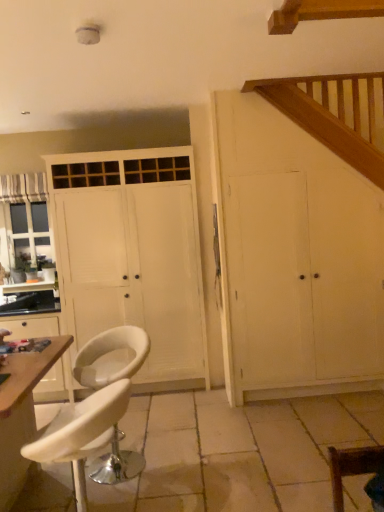
Question: Is matte white cabinet at left outside of striped fabric curtain at left?

Choices:
 (A) yes
 (B) no

Answer: (A)

Question: Is matte white cabinet at left positioned in front of striped fabric curtain at left?

Choices:
 (A) yes
 (B) no

Answer: (A)

Question: From the image's perspective, is matte white cabinet at left beneath striped fabric curtain at left?

Choices:
 (A) no
 (B) yes

Answer: (B)

Question: From the image's perspective, is matte white cabinet at left above striped fabric curtain at left?

Choices:
 (A) yes
 (B) no

Answer: (B)

Question: Is matte white cabinet at left not close to striped fabric curtain at left?

Choices:
 (A) no
 (B) yes

Answer: (B)

Question: Is matte white cabinet at left at the right side of striped fabric curtain at left?

Choices:
 (A) no
 (B) yes

Answer: (B)

Question: From the image's perspective, is white matte cabinet at center, the second cupboard in the right-to-left sequence, located beneath white wood cupboard at right, the 1th cupboard viewed from the right?

Choices:
 (A) yes
 (B) no

Answer: (B)

Question: Is white matte cabinet at center, the second cupboard in the right-to-left sequence, taller than white wood cupboard at right, which ranks as the second cupboard in left-to-right order?

Choices:
 (A) yes
 (B) no

Answer: (A)

Question: Considering the relative sizes of white matte cabinet at center, the second cupboard in the right-to-left sequence, and white wood cupboard at right, the 1th cupboard viewed from the right, in the image provided, is white matte cabinet at center, the second cupboard in the right-to-left sequence, shorter than white wood cupboard at right, the 1th cupboard viewed from the right,?

Choices:
 (A) no
 (B) yes

Answer: (A)

Question: Is white matte cabinet at center, which is the 1th cupboard in left-to-right order, turned away from white wood cupboard at right, which ranks as the second cupboard in left-to-right order?

Choices:
 (A) no
 (B) yes

Answer: (A)

Question: Is the position of white matte cabinet at center, which is the 1th cupboard in left-to-right order, more distant than that of white wood cupboard at right, which ranks as the second cupboard in left-to-right order?

Choices:
 (A) no
 (B) yes

Answer: (B)

Question: Does white matte cabinet at center, the second cupboard in the right-to-left sequence, lie in front of white wood cupboard at right, which ranks as the second cupboard in left-to-right order?

Choices:
 (A) yes
 (B) no

Answer: (B)

Question: Considering the relative positions of matte white cabinet at left and white leather chair at lower right, placed as the 3th chair when sorted from back to front, in the image provided, is matte white cabinet at left to the right of white leather chair at lower right, placed as the 3th chair when sorted from back to front, from the viewer's perspective?

Choices:
 (A) no
 (B) yes

Answer: (A)